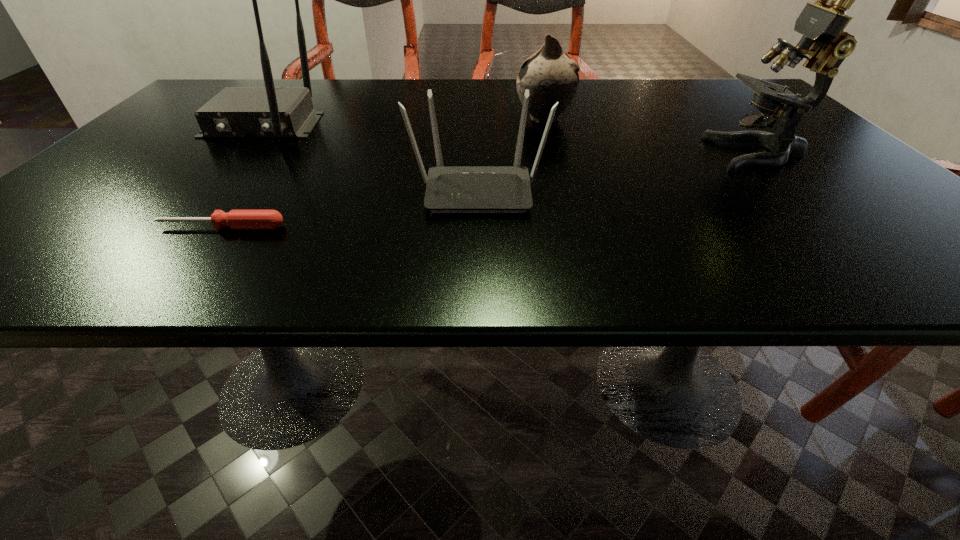
I want to click on object that is at the left edge, so click(269, 111).

Find the location of `object that is at the right edge`. object that is at the right edge is located at coordinates (821, 23).

You are a GUI agent. You are given a task and a screenshot of the screen. Output one action in this format:
    pyautogui.click(x=<x>, y=<y>)
    Task: Click on the object positioned at the far left corner
    The height and width of the screenshot is (540, 960).
    Given the screenshot: What is the action you would take?
    pyautogui.click(x=269, y=111)

Identify the location of blank space at the far edge. (686, 106).

In the image, there is a desktop. In order to click on vacant space at the near edge in this screenshot , I will do coord(485,278).

The image size is (960, 540). Identify the location of free space at the left edge. (102, 205).

Find the location of a particular element. Image resolution: width=960 pixels, height=540 pixels. free space at the far left corner of the desktop is located at coordinates (226, 86).

Identify the location of free space between the third shortest object and the second tallest object. The height and width of the screenshot is (540, 960). (403, 122).

Locate an element on the screen. The image size is (960, 540). free space that is in between the farther router and the rightmost object is located at coordinates click(x=511, y=139).

In order to click on free space between the third shortest object and the rightmost object in this screenshot , I will do `click(651, 136)`.